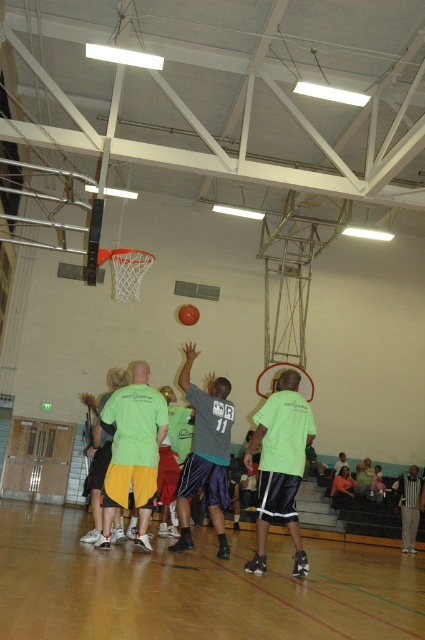
Question: Considering the real-world distances, which object is closest to the gray pants at lower right?

Choices:
 (A) gray fabric shorts at center
 (B) green fabric shirt at center
 (C) green jersey at center

Answer: (A)

Question: Which object appears closest to the camera in this image?

Choices:
 (A) gray pants at lower right
 (B) orange rubber basketball at center
 (C) green jersey at center

Answer: (C)

Question: Which of the following is the farthest from the observer?

Choices:
 (A) green matte shorts at center
 (B) green jersey at center
 (C) gray fabric shorts at center

Answer: (B)

Question: Can you confirm if gray pants at lower right is bigger than orange rubber basketball at center?

Choices:
 (A) yes
 (B) no

Answer: (A)

Question: Does green matte shorts at center appear on the left side of gray pants at lower right?

Choices:
 (A) no
 (B) yes

Answer: (B)

Question: Does wooden floor at lower center have a smaller size compared to orange rubber basketball at center?

Choices:
 (A) no
 (B) yes

Answer: (A)